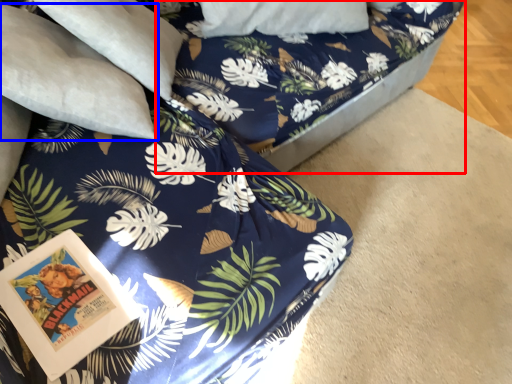
Question: Which of the following is the closest to the observer, bed frame (highlighted by a red box) or pillow (highlighted by a blue box)?

Choices:
 (A) bed frame
 (B) pillow

Answer: (B)